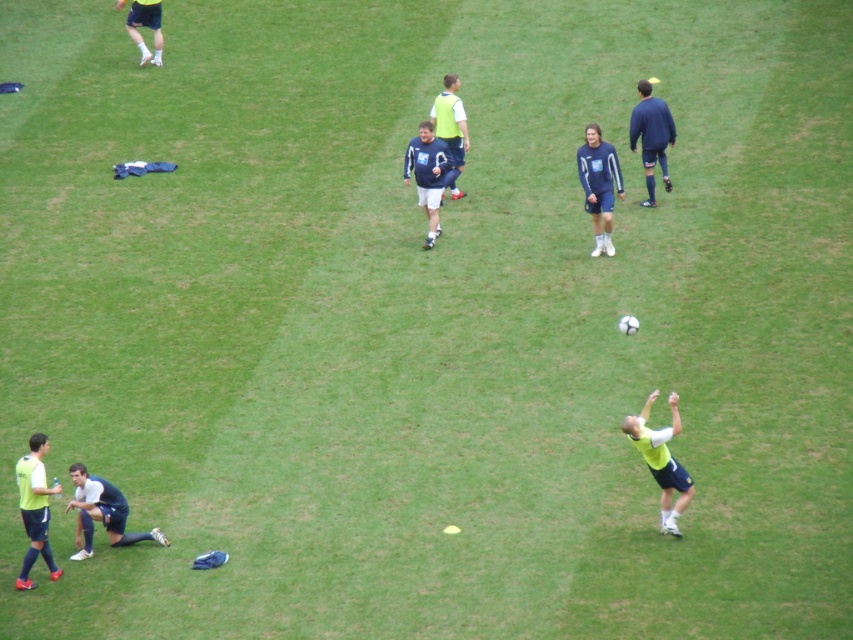
Who is lower down, matte green shorts at lower left or light green jersey at center?

matte green shorts at lower left is below.

Is matte green shorts at lower left positioned before light green jersey at center?

Yes.

Who is more distant from viewer, (26, 476) or (456, 168)?

The point (456, 168) is more distant.

In order to click on matte green shorts at lower left in this screenshot , I will do `click(35, 508)`.

Can you confirm if dark blue uniform at lower left is taller than matte blue shorts at center?

No.

Can you confirm if dark blue uniform at lower left is positioned to the right of matte blue shorts at center?

Incorrect, dark blue uniform at lower left is not on the right side of matte blue shorts at center.

Which is behind, point (109, 532) or point (585, 176)?

The point (585, 176) is more distant.

Locate an element on the screen. dark blue uniform at lower left is located at coordinates (102, 513).

In the scene shown: Does matte blue shirt at center have a larger size compared to light green jersey at center?

Incorrect, matte blue shirt at center is not larger than light green jersey at center.

Does matte blue shirt at center appear under light green jersey at center?

Correct, matte blue shirt at center is located below light green jersey at center.

Who is more forward, (447, 172) or (459, 156)?

Point (447, 172)

Locate an element on the screen. matte blue shirt at center is located at coordinates (427, 173).